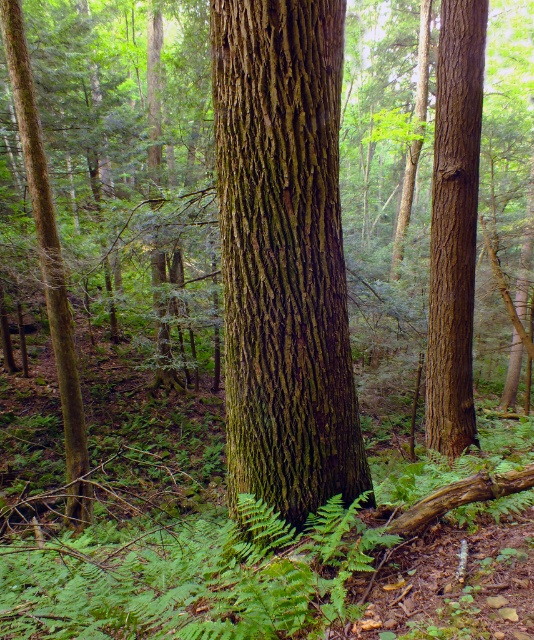
You are a hiker trying to navigate through the forest and see the green rough bark tree trunk at center and the green rough bark tree at left. Which tree is closer to the left side of your view?

The green rough bark tree at left is closer to the left side of your view because it is positioned to the left of the green rough bark tree trunk at center.

You are a hiker who wants to take a photo of the green rough bark tree trunk at center and the green rough bark tree at left. Which tree should you move closer to in order to get a clearer picture of its bark details?

You should move closer to the green rough bark tree trunk at center because it is in front of the green rough bark tree at left, making it easier to capture detailed shots without obstruction.